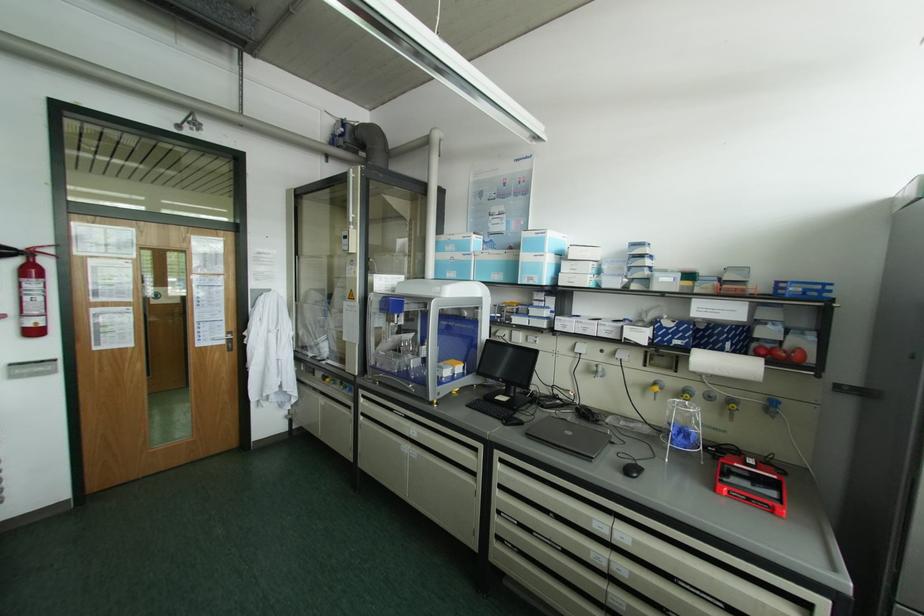
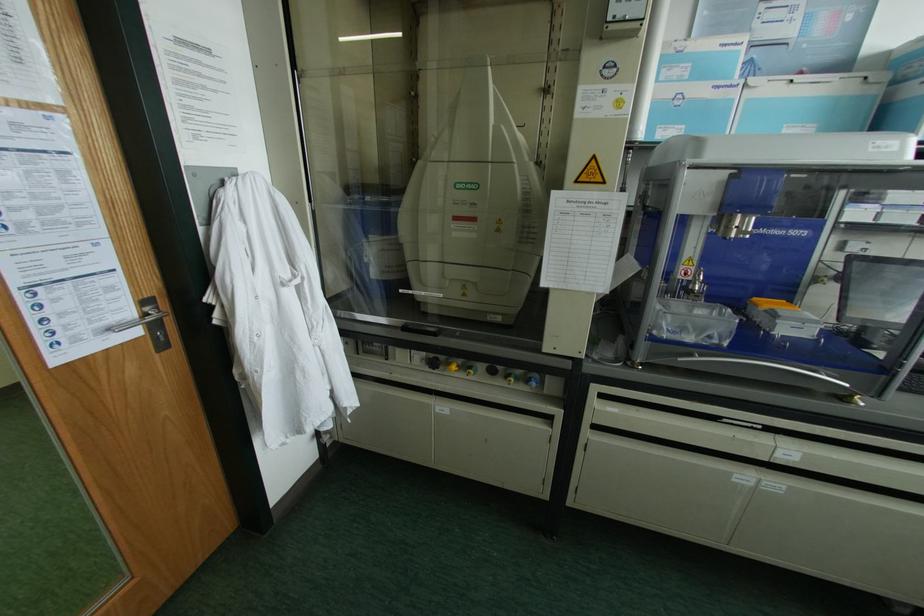
Find the pixel in the second image that matches pixel 227 331 in the first image.

(142, 302)